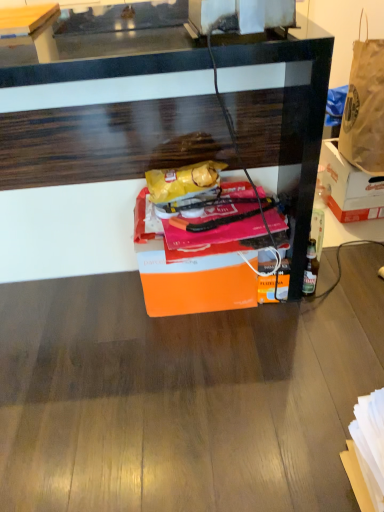
The width and height of the screenshot is (384, 512). What do you see at coordinates (194, 271) in the screenshot? I see `orange matte box at center, which is the 2th box in right-to-left order` at bounding box center [194, 271].

Find the location of a particular element. The width and height of the screenshot is (384, 512). brown paper bag at upper right is located at coordinates (365, 106).

Find the location of a particular element. The width and height of the screenshot is (384, 512). orange matte box at center, which is the 2th box in right-to-left order is located at coordinates (194, 271).

Is orange matte box at center, arranged as the 1th box when viewed from the front, inside or outside of orange cardboard box at right, acting as the first box starting from the back?

orange matte box at center, arranged as the 1th box when viewed from the front, is not inside orange cardboard box at right, acting as the first box starting from the back, it's outside.

Considering the sizes of objects orange matte box at center, which ranks as the second box in back-to-front order, and orange cardboard box at right, marked as the 2th box in a front-to-back arrangement, in the image provided, who is smaller, orange matte box at center, which ranks as the second box in back-to-front order, or orange cardboard box at right, marked as the 2th box in a front-to-back arrangement,?

orange cardboard box at right, marked as the 2th box in a front-to-back arrangement, is smaller.

Does orange matte box at center, which is the 2th box in right-to-left order, come behind orange cardboard box at right, the second box positioned from the left?

No, orange matte box at center, which is the 2th box in right-to-left order, is closer to the camera.

Is orange matte box at center, arranged as the 1th box when viewed from the front, with orange cardboard box at right, marked as the 2th box in a front-to-back arrangement?

orange matte box at center, arranged as the 1th box when viewed from the front, and orange cardboard box at right, marked as the 2th box in a front-to-back arrangement, are clearly separated.

Is orange matte box at center, the 1th box positioned from the left, further to camera compared to wooden desk at center?

Yes.

From the image's perspective, is orange matte box at center, the 1th box positioned from the left, positioned above or below wooden desk at center?

orange matte box at center, the 1th box positioned from the left, is below wooden desk at center.

Can you confirm if orange matte box at center, which ranks as the second box in back-to-front order, is taller than wooden desk at center?

No, orange matte box at center, which ranks as the second box in back-to-front order, is not taller than wooden desk at center.

How far apart are orange matte box at center, arranged as the 1th box when viewed from the front, and wooden desk at center?

12.37 inches.

Between wooden desk at center and orange matte box at center, which is the 2th box in right-to-left order, which one appears on the right side from the viewer's perspective?

From the viewer's perspective, orange matte box at center, which is the 2th box in right-to-left order, appears more on the right side.

Between wooden desk at center and orange matte box at center, which ranks as the second box in back-to-front order, which one has more height?

wooden desk at center is taller.

Which is more distant, (293, 281) or (254, 272)?

Positioned behind is point (293, 281).

Between wooden desk at center and orange cardboard box at right, the second box positioned from the left, which one appears on the right side from the viewer's perspective?

From the viewer's perspective, orange cardboard box at right, the second box positioned from the left, appears more on the right side.

Considering the sizes of objects wooden desk at center and orange cardboard box at right, the second box positioned from the left, in the image provided, who is bigger, wooden desk at center or orange cardboard box at right, the second box positioned from the left,?

wooden desk at center.

Is orange cardboard box at right, the second box positioned from the left, a part of wooden desk at center?

Definitely not — orange cardboard box at right, the second box positioned from the left, is not inside wooden desk at center.

The height and width of the screenshot is (512, 384). I want to click on the 2nd box behind when counting from the wooden desk at center, so click(x=348, y=187).

Which of these two, orange cardboard box at right, acting as the first box starting from the back, or wooden desk at center, stands shorter?

With less height is orange cardboard box at right, acting as the first box starting from the back.

How different are the orientations of orange cardboard box at right, marked as the 2th box in a front-to-back arrangement, and wooden desk at center in degrees?

orange cardboard box at right, marked as the 2th box in a front-to-back arrangement, and wooden desk at center are facing 90.1 degrees away from each other.

Consider the image. Is orange cardboard box at right, marked as the 2th box in a front-to-back arrangement, positioned with its back to wooden desk at center?

No.

Considering the sizes of objects orange cardboard box at right, marked as the 2th box in a front-to-back arrangement, and wooden desk at center in the image provided, who is smaller, orange cardboard box at right, marked as the 2th box in a front-to-back arrangement, or wooden desk at center?

With smaller size is orange cardboard box at right, marked as the 2th box in a front-to-back arrangement.

Which of these two, brown paper bag at upper right or wooden desk at center, stands taller?

wooden desk at center is taller.

This screenshot has width=384, height=512. Find the location of `desk below the brown paper bag at upper right (from a real-world perspective)`. desk below the brown paper bag at upper right (from a real-world perspective) is located at coordinates (108, 110).

Can you confirm if brown paper bag at upper right is thinner than wooden desk at center?

Yes, brown paper bag at upper right is thinner than wooden desk at center.

Considering the relative positions of brown paper bag at upper right and wooden desk at center in the image provided, is brown paper bag at upper right to the left of wooden desk at center from the viewer's perspective?

In fact, brown paper bag at upper right is to the right of wooden desk at center.

Which point is more distant from viewer, [34,18] or [362,141]?

Positioned behind is point [362,141].

From a real-world perspective, which object rests below the other?

From a 3D spatial view, brown paper bag at upper right is below.

Locate an element on the screen. box behind the orange matte box at center, arranged as the 1th box when viewed from the front is located at coordinates [348, 187].

Find the location of a particular element. desk on the left of orange matte box at center, which is the 2th box in right-to-left order is located at coordinates (108, 110).

Which object lies nearer to the anchor point orange cardboard box at right, positioned as the first box in right-to-left order, orange matte box at center, arranged as the 1th box when viewed from the front, or wooden desk at center?

wooden desk at center.

Which object lies nearer to the anchor point wooden table at upper left, wooden desk at center or orange cardboard box at right, marked as the 2th box in a front-to-back arrangement?

The object closer to wooden table at upper left is wooden desk at center.

Based on their spatial positions, is orange cardboard box at right, marked as the 2th box in a front-to-back arrangement, or brown paper bag at upper right further from orange matte box at center, arranged as the 1th box when viewed from the front?

brown paper bag at upper right is further to orange matte box at center, arranged as the 1th box when viewed from the front.

Based on their spatial positions, is wooden table at upper left or orange matte box at center, which is the 2th box in right-to-left order, further from wooden desk at center?

Among the two, wooden table at upper left is located further to wooden desk at center.

Based on their spatial positions, is orange matte box at center, the 1th box positioned from the left, or wooden table at upper left closer to brown paper bag at upper right?

The object closer to brown paper bag at upper right is orange matte box at center, the 1th box positioned from the left.

Based on their spatial positions, is wooden table at upper left or orange cardboard box at right, positioned as the first box in right-to-left order, further from wooden desk at center?

wooden table at upper left lies further to wooden desk at center than the other object.

Considering their positions, is brown paper bag at upper right positioned further to orange cardboard box at right, acting as the first box starting from the back, than orange matte box at center, which is the 2th box in right-to-left order?

orange matte box at center, which is the 2th box in right-to-left order.

Based on their spatial positions, is wooden desk at center or wooden table at upper left further from brown paper bag at upper right?

wooden table at upper left lies further to brown paper bag at upper right than the other object.

The width and height of the screenshot is (384, 512). Find the location of `box between wooden desk at center and orange cardboard box at right, marked as the 2th box in a front-to-back arrangement, from left to right`. box between wooden desk at center and orange cardboard box at right, marked as the 2th box in a front-to-back arrangement, from left to right is located at coordinates (194, 271).

You are a GUI agent. You are given a task and a screenshot of the screen. Output one action in this format:
    pyautogui.click(x=<x>, y=<y>)
    Task: Click on the handbag situated between wooden table at upper left and orange cardboard box at right, acting as the first box starting from the back, from left to right
    Image resolution: width=384 pixels, height=512 pixels.
    Given the screenshot: What is the action you would take?
    pyautogui.click(x=365, y=106)

Find the location of `box located between wooden table at upper left and orange cardboard box at right, marked as the 2th box in a front-to-back arrangement, in the left-right direction`. box located between wooden table at upper left and orange cardboard box at right, marked as the 2th box in a front-to-back arrangement, in the left-right direction is located at coordinates (194, 271).

This screenshot has width=384, height=512. What are the coordinates of `handbag located between wooden desk at center and orange cardboard box at right, positioned as the first box in right-to-left order, in the left-right direction` in the screenshot? It's located at (365, 106).